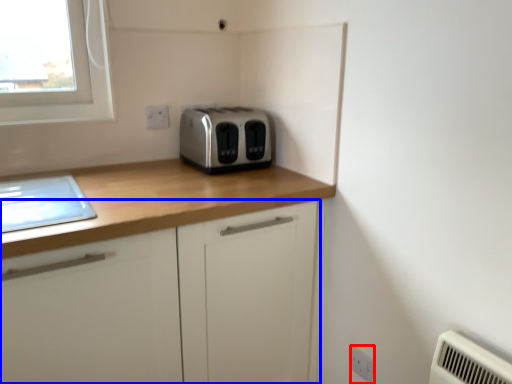
Question: Which of the following is the farthest to the observer, electric outlet (highlighted by a red box) or cabinetry (highlighted by a blue box)?

Choices:
 (A) electric outlet
 (B) cabinetry

Answer: (A)